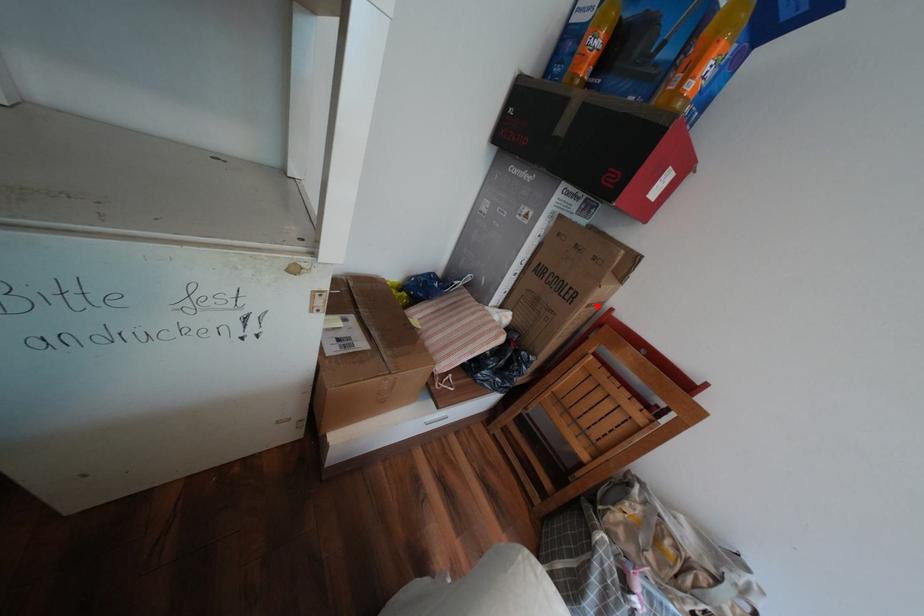
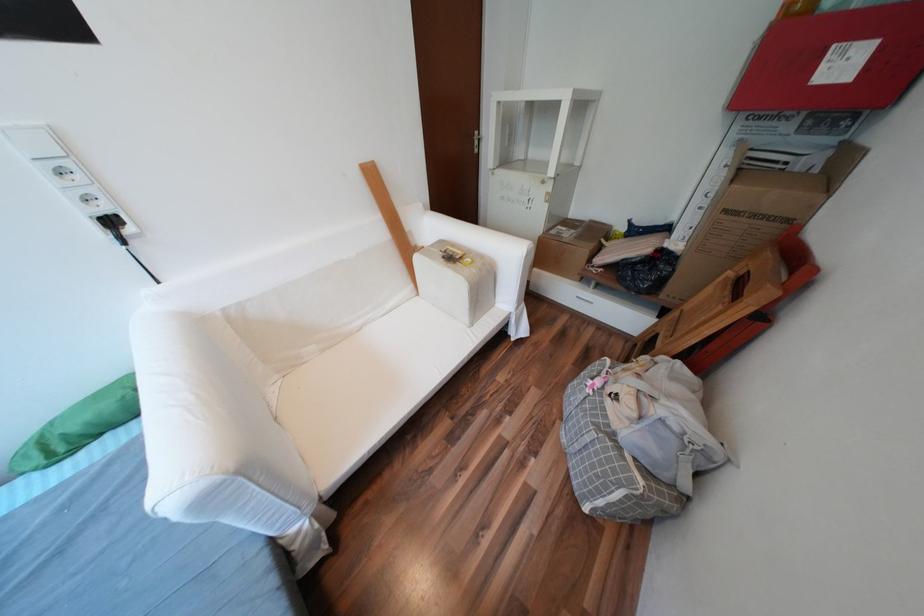
In the second image, find the point that corresponds to the highlighted location in the first image.

(736, 211)